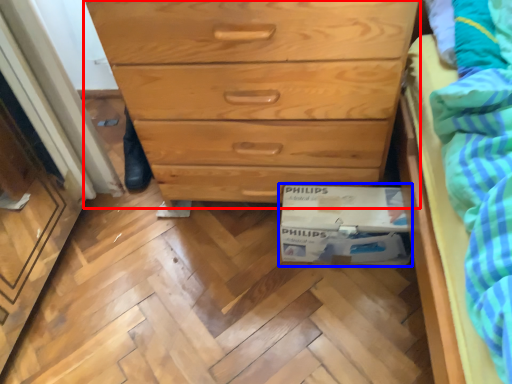
Question: Which object appears closest to the camera in this image, chest of drawers (highlighted by a red box) or cardboard box (highlighted by a blue box)?

Choices:
 (A) chest of drawers
 (B) cardboard box

Answer: (A)